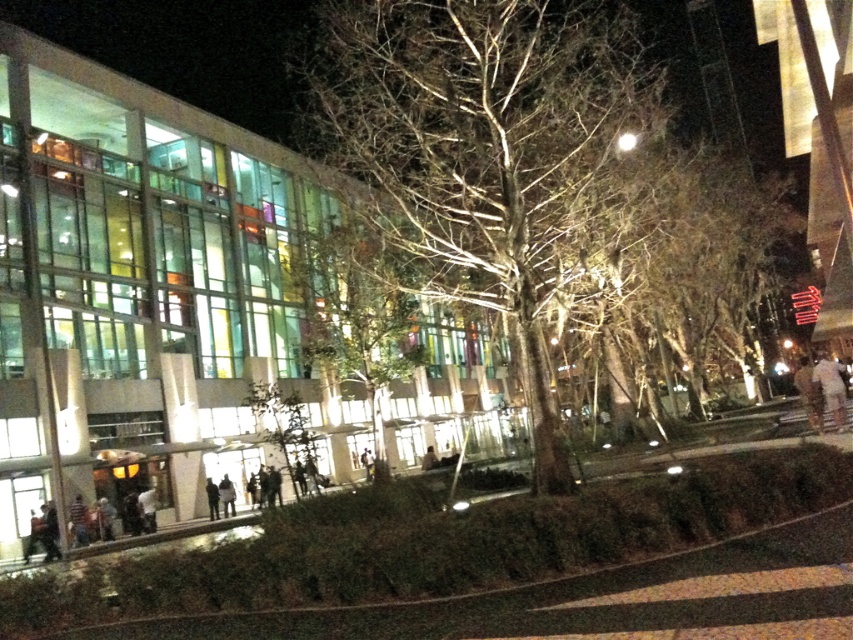
Looking at this image, you are standing in front of the modern building at night and see two jackets. The dark gray jacket at lower center and the dark gray fabric jacket at lower left. Which jacket is positioned more to the right side?

The dark gray jacket at lower center is positioned more to the right side than the dark gray fabric jacket at lower left.

You are standing at the camera position observing the nighttime urban scene. There is a dark gray jacket at lower center. Can you pick up the jacket without moving closer than 50 meters?

The dark gray jacket at lower center is 50.32 meters away from the camera, so you cannot reach it without moving closer than 50 meters.